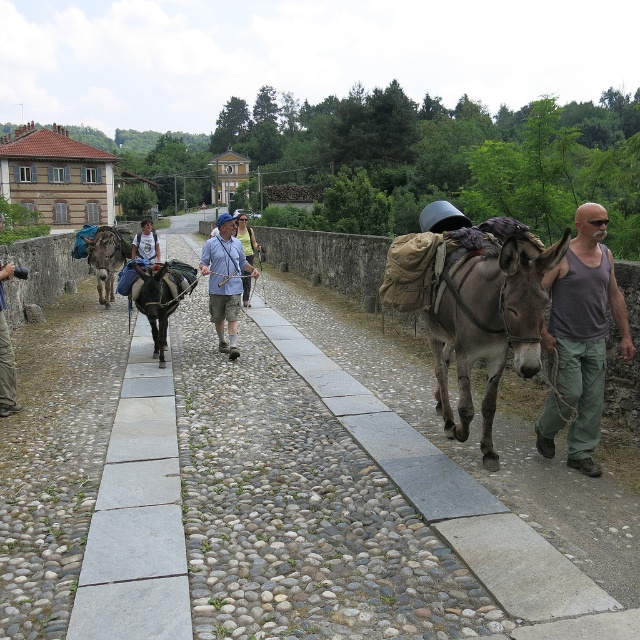
You are a photographer standing on the cobblestone path. You want to take a photo of the gray tank top at right and the dark brown leather mule at center. Which object should you focus on first if you want to capture both in the same frame without moving your camera?

The gray tank top at right is taller than the dark brown leather mule at center, so you should focus on the gray tank top at right first to ensure it fits within the frame.

You are a photographer standing on the cobblestone path and want to take a picture of the gray tank top at right and the dark brown leather mule at center. Which object should you focus on first if you want to capture both in the same frame without moving the camera?

You should focus on the dark brown leather mule at center first because the gray tank top at right is located below it, so adjusting focus to the mule will ensure both are in the frame.